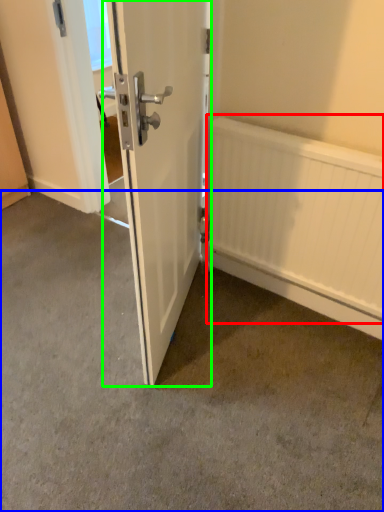
Question: Which object is the closest to the radiator (highlighted by a red box)? Choose among these: concrete (highlighted by a blue box) or door (highlighted by a green box).

Choices:
 (A) concrete
 (B) door

Answer: (B)